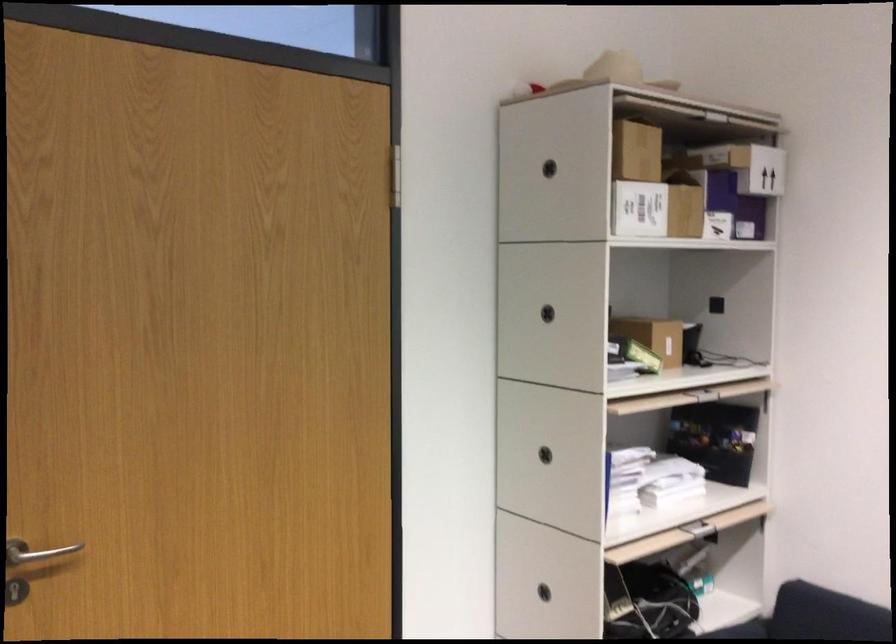
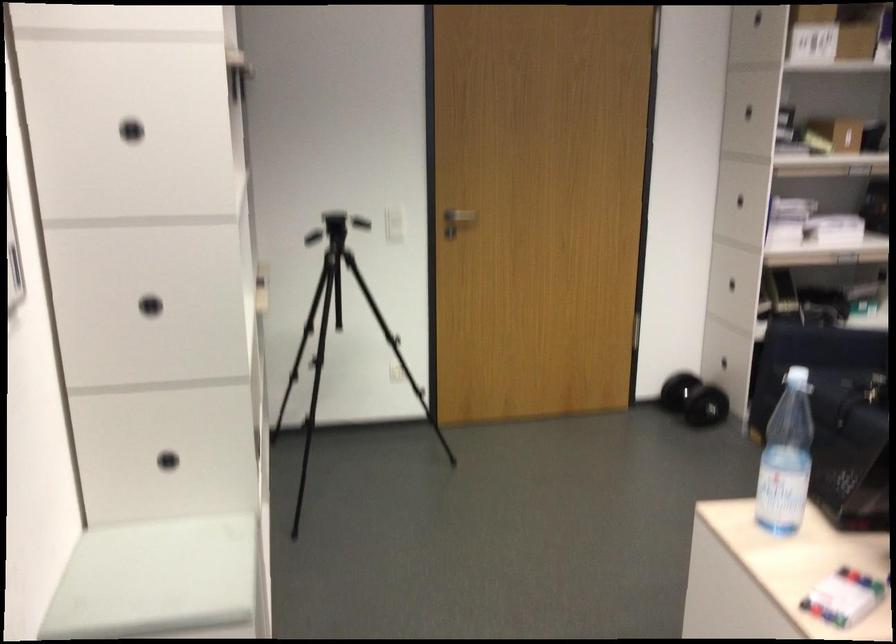
Find the pixel in the second image that matches the point at 74,554 in the first image.

(460, 216)